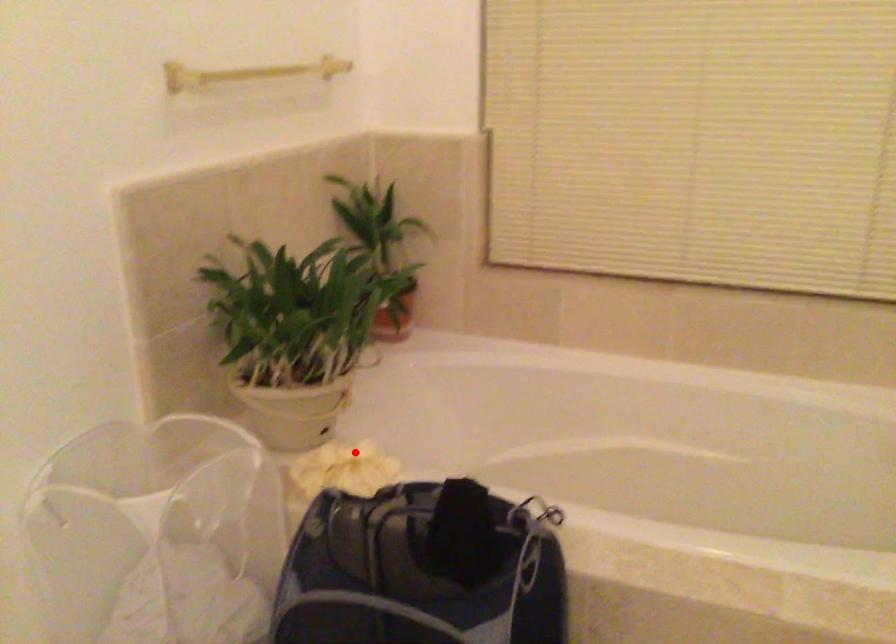
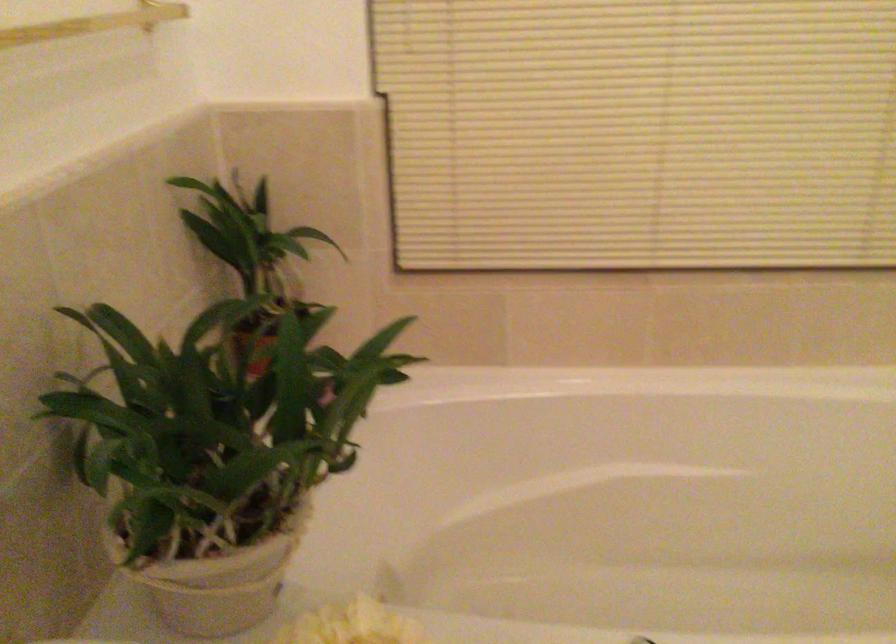
Question: I am providing you with two images of the same scene from different viewpoints. In image1, a red point is highlighted. Considering the same 3D point in image2, which of the following is correct?

Choices:
 (A) It is closer
 (B) It is farther

Answer: (A)